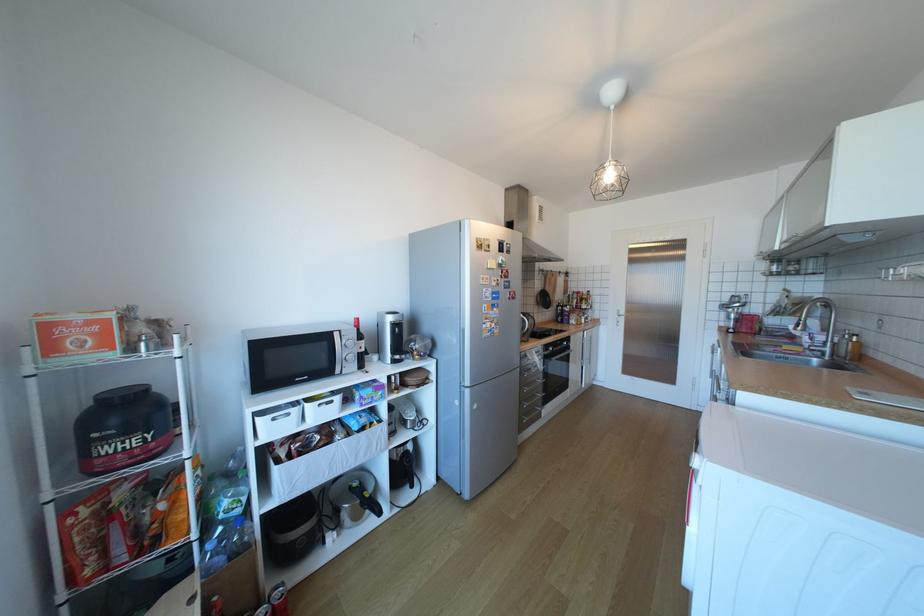
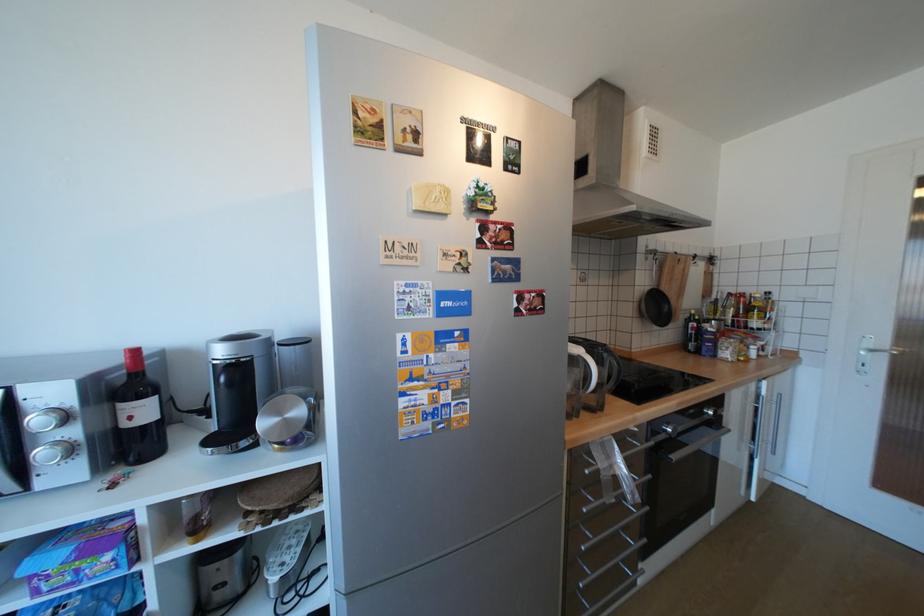
In the second image, find the point that corresponds to point 427,357 in the first image.

(286, 446)